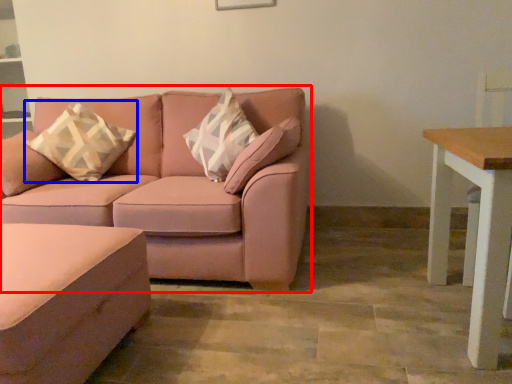
Question: Among these objects, which one is farthest to the camera, studio couch (highlighted by a red box) or throw pillow (highlighted by a blue box)?

Choices:
 (A) studio couch
 (B) throw pillow

Answer: (B)